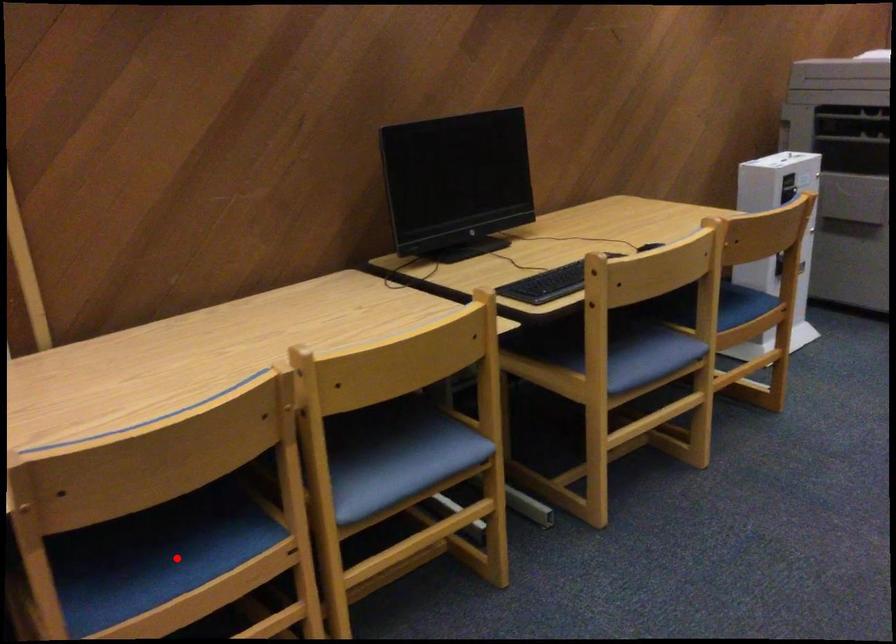
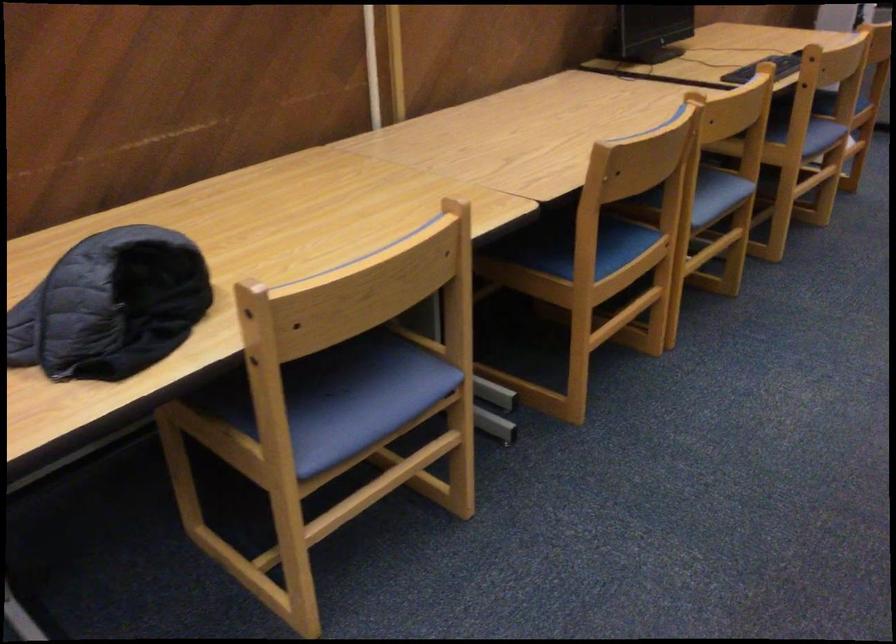
Where in the second image is the point corresponding to the highlighted location from the first image?

(597, 248)